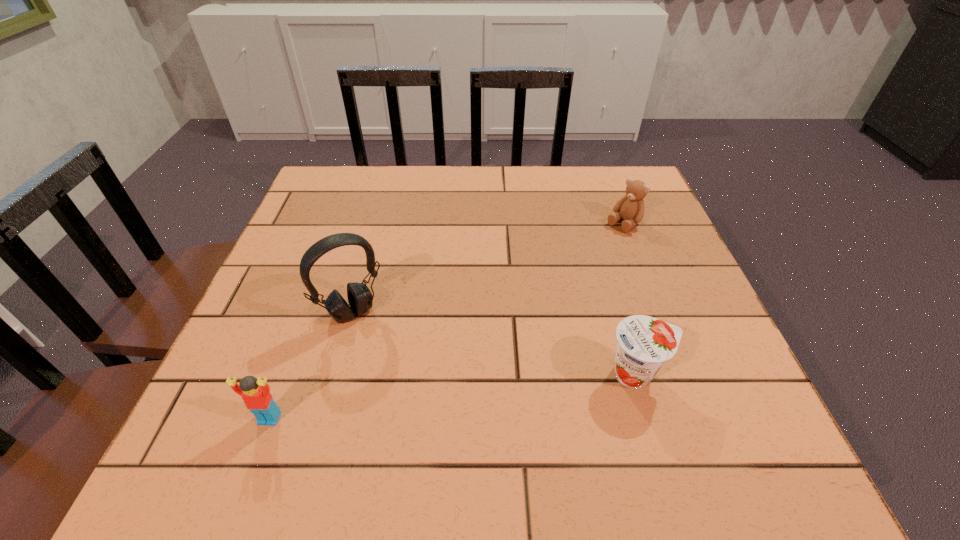
Locate an element on the screen. vacant spot on the desktop that is between the Lego and the yogurt and is positioned on the front-facing side of the headset is located at coordinates (x=410, y=401).

In order to click on free spot on the desktop that is between the Lego and the third farthest object and is positioned on the front-facing side of the teddy bear in this screenshot , I will do `click(410, 401)`.